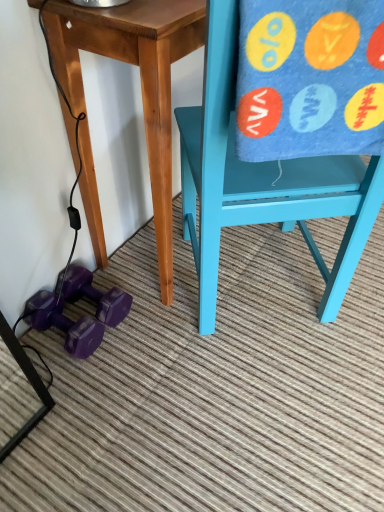
Question: Looking at their shapes, would you say blue felt beach towel at right is wider or thinner than matte blue chair at right?

Choices:
 (A) thin
 (B) wide

Answer: (A)

Question: Do you think blue felt beach towel at right is within matte blue chair at right, or outside of it?

Choices:
 (A) outside
 (B) inside

Answer: (B)

Question: Estimate the real-world distances between objects in this image. Which object is closer to the matte blue chair at right?

Choices:
 (A) blue felt beach towel at right
 (B) purple rubber dumbbell at lower left, which ranks as the 1th dumbbell in top-to-bottom order
 (C) purple rubber dumbbell at lower left, the 1th dumbbell from the bottom
 (D) wooden table at center

Answer: (D)

Question: Which object is positioned farthest from the purple rubber dumbbell at lower left, which is the 2th dumbbell in bottom-to-top order?

Choices:
 (A) wooden table at center
 (B) matte blue chair at right
 (C) purple rubber dumbbell at lower left, the second dumbbell in the top-to-bottom sequence
 (D) blue felt beach towel at right

Answer: (D)